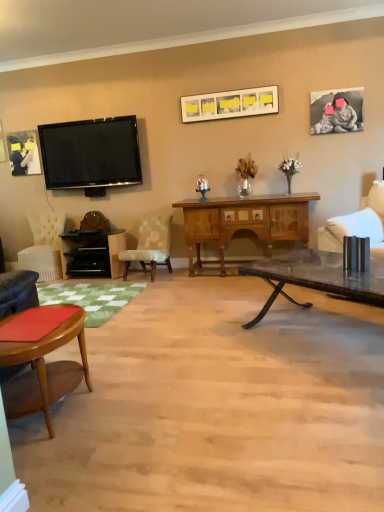
Question: Does white fabric chair at right, the third chair when ordered from back to front, contain matte black picture frame at upper left, the 1th picture frame in the left-to-right sequence?

Choices:
 (A) yes
 (B) no

Answer: (B)

Question: Can you confirm if white fabric chair at right, positioned as the fourth chair in left-to-right order, is bigger than matte black picture frame at upper left, which is the 3th picture frame from right to left?

Choices:
 (A) yes
 (B) no

Answer: (A)

Question: Is white fabric chair at right, which is counted as the second chair, starting from the front, positioned far away from matte black picture frame at upper left, which is the 3th picture frame from right to left?

Choices:
 (A) no
 (B) yes

Answer: (B)

Question: Is the depth of white fabric chair at right, the third chair when ordered from back to front, greater than that of matte black picture frame at upper left, which is the 3th picture frame from right to left?

Choices:
 (A) no
 (B) yes

Answer: (A)

Question: Is white fabric chair at right, the third chair when ordered from back to front, with matte black picture frame at upper left, the 1th picture frame in the left-to-right sequence?

Choices:
 (A) no
 (B) yes

Answer: (A)

Question: Is point [x=54, y=225] positioned closer to the camera than point [x=233, y=272]?

Choices:
 (A) closer
 (B) farther

Answer: (B)

Question: Considering their positions, is velvet white chair at left, marked as the first chair in a left-to-right arrangement, located in front of or behind wooden cabinet at center?

Choices:
 (A) front
 (B) behind

Answer: (B)

Question: Considering the relative positions of velvet white chair at left, the 1th chair from the back, and wooden cabinet at center in the image provided, is velvet white chair at left, the 1th chair from the back, to the left or to the right of wooden cabinet at center?

Choices:
 (A) left
 (B) right

Answer: (A)

Question: In terms of width, does velvet white chair at left, the 1th chair from the back, look wider or thinner when compared to wooden cabinet at center?

Choices:
 (A) thin
 (B) wide

Answer: (B)

Question: From the image's perspective, relative to matte white picture frame at upper center, which appears as the 2th picture frame when viewed from the back, is black matte photo frame at upper right, which is the 1th picture frame from front to back, above or below?

Choices:
 (A) above
 (B) below

Answer: (B)

Question: From a real-world perspective, is black matte photo frame at upper right, which is counted as the third picture frame, starting from the left, above or below matte white picture frame at upper center, the second picture frame when ordered from right to left?

Choices:
 (A) above
 (B) below

Answer: (B)

Question: Is black matte photo frame at upper right, which is the 1th picture frame from front to back, spatially inside matte white picture frame at upper center, the second picture frame when ordered from right to left, or outside of it?

Choices:
 (A) inside
 (B) outside

Answer: (B)

Question: Considering the positions of black matte photo frame at upper right, acting as the first picture frame starting from the right, and matte white picture frame at upper center, which is the second picture frame from front to back, in the image, is black matte photo frame at upper right, acting as the first picture frame starting from the right, bigger or smaller than matte white picture frame at upper center, which is the second picture frame from front to back,?

Choices:
 (A) big
 (B) small

Answer: (B)

Question: Is point (274, 212) closer or farther from the camera than point (14, 166)?

Choices:
 (A) farther
 (B) closer

Answer: (B)

Question: In terms of height, does wooden cabinet at center look taller or shorter compared to matte black picture frame at upper left, which ranks as the 1th picture frame in back-to-front order?

Choices:
 (A) tall
 (B) short

Answer: (A)